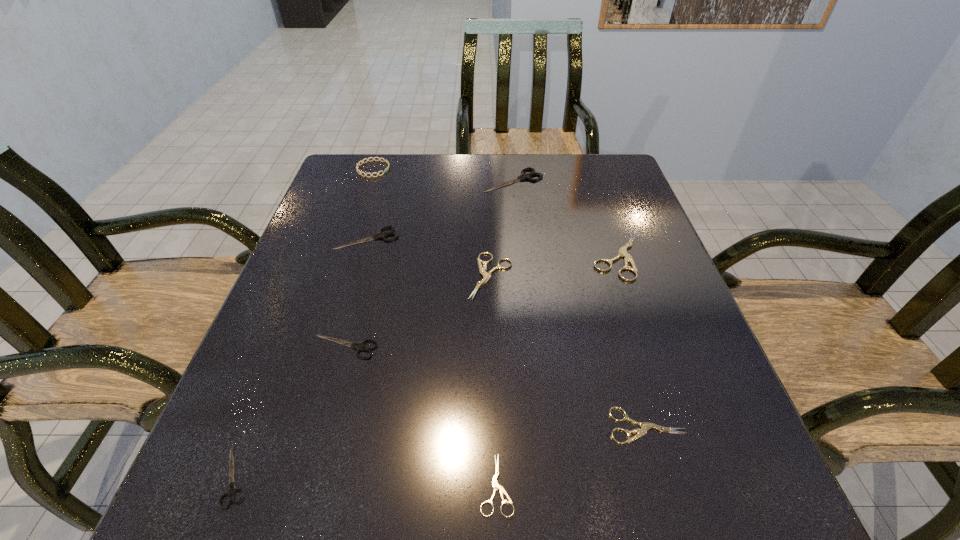
You are a GUI agent. You are given a task and a screenshot of the screen. Output one action in this format:
    pyautogui.click(x=<x>, y=<y>)
    Task: Click on the third biggest beige shears
    The image size is (960, 540).
    Given the screenshot: What is the action you would take?
    pyautogui.click(x=645, y=426)

Find the location of a particular element. The height and width of the screenshot is (540, 960). the nearest black shears is located at coordinates (232, 490).

At what (x,y) coordinates should I click in order to perform the action: click on the shortest object. Please return your answer as a coordinate pair (x, y). The height and width of the screenshot is (540, 960). Looking at the image, I should click on (496, 486).

The height and width of the screenshot is (540, 960). I want to click on the smallest beige shears, so click(496, 486).

This screenshot has height=540, width=960. I want to click on vacant space positioned 0.130m on the surface of the blue bracelet showing star-shaped elements, so click(434, 169).

Identify the location of blank space located 0.360m on the left of the farthest shears. This screenshot has width=960, height=540. (355, 180).

Locate an element on the screen. The width and height of the screenshot is (960, 540). vacant area situated 0.400m on the right of the second biggest black shears is located at coordinates (565, 238).

At what (x,y) coordinates should I click in order to perform the action: click on vacant space located 0.120m on the left of the biggest beige shears. Please return your answer as a coordinate pair (x, y). This screenshot has height=540, width=960. Looking at the image, I should click on (539, 255).

Identify the location of vacant space located 0.100m on the right of the third farthest black shears. (431, 347).

I want to click on vacant space located 0.290m on the left of the second biggest beige shears, so click(336, 276).